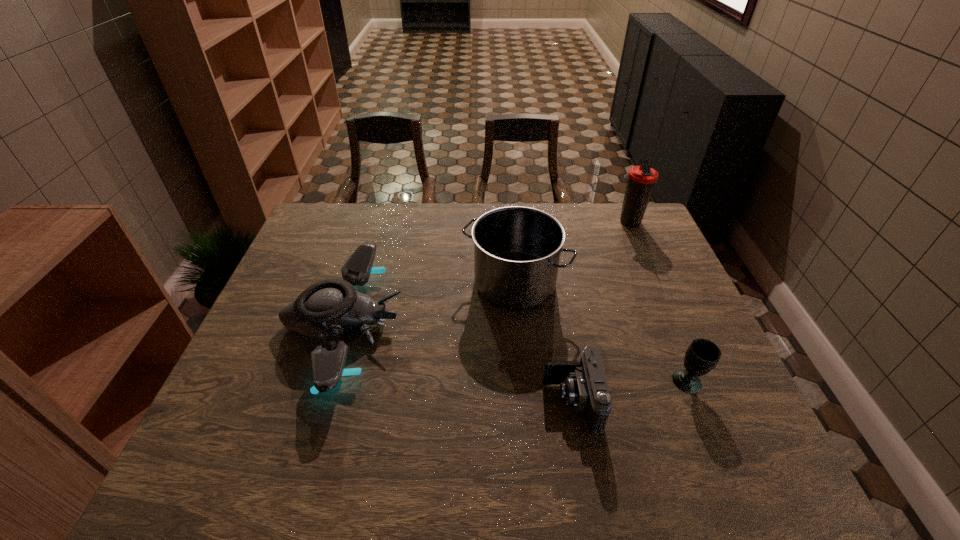
The image size is (960, 540). I want to click on thermos bottle, so click(641, 179).

This screenshot has width=960, height=540. I want to click on the farthest object, so click(641, 179).

What are the coordinates of `saucepan` in the screenshot? It's located at pyautogui.click(x=517, y=249).

Identify the location of chalice. The width and height of the screenshot is (960, 540). (702, 355).

This screenshot has width=960, height=540. In order to click on camera in this screenshot , I will do `click(583, 384)`.

Identify the location of the leftmost object. (328, 307).

Find the location of `vacant position located 0.090m on the left of the tallest object`. vacant position located 0.090m on the left of the tallest object is located at coordinates (588, 222).

Locate an element on the screen. blank space located 0.070m on the back of the saucepan is located at coordinates (512, 242).

The width and height of the screenshot is (960, 540). I want to click on free space located 0.100m on the front of the chalice, so click(x=709, y=435).

This screenshot has height=540, width=960. I want to click on vacant position located 0.400m at the front of the camera with an open lens cover, so click(369, 402).